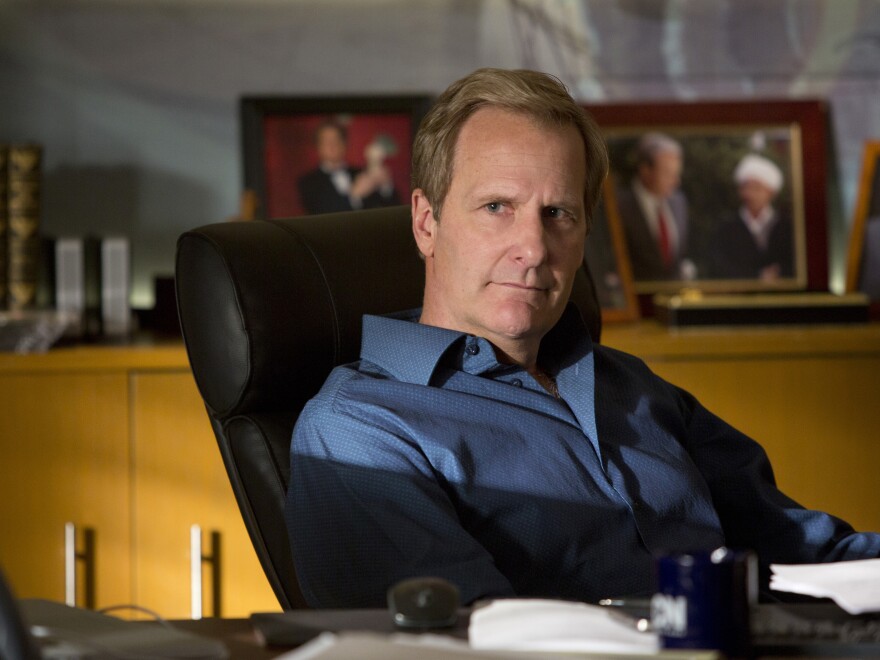
Image resolution: width=880 pixels, height=660 pixels. Find the location of `chair`. chair is located at coordinates (319, 284).